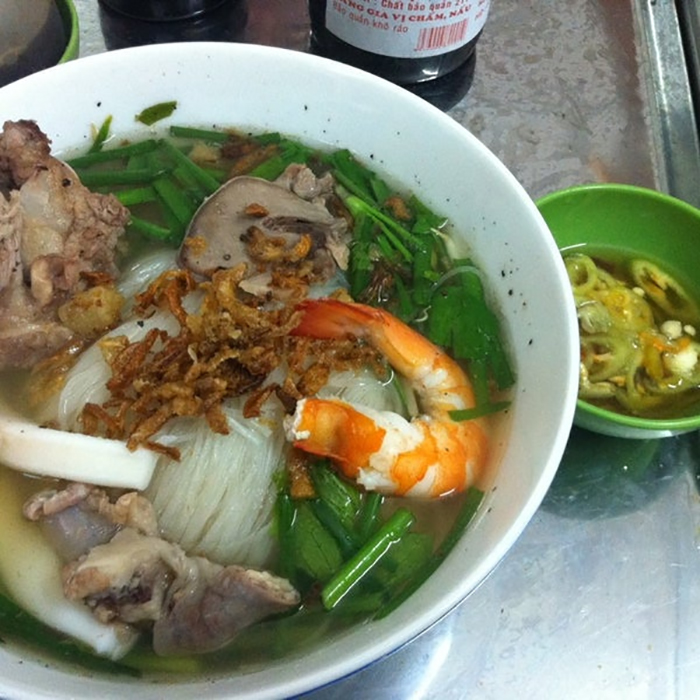
In order to click on sauce bottles in this screenshot , I will do `click(410, 75)`, `click(148, 18)`, `click(47, 42)`.